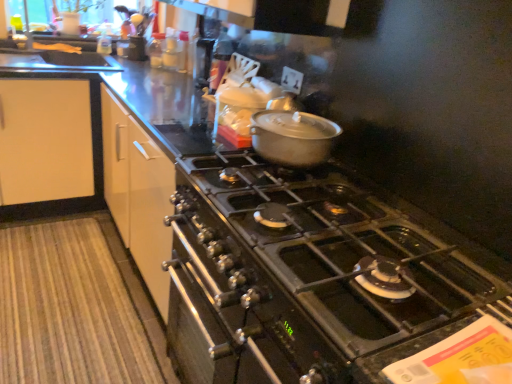
The height and width of the screenshot is (384, 512). What are the coordinates of `matte silver pot at center` in the screenshot? It's located at (293, 137).

This screenshot has width=512, height=384. What do you see at coordinates (57, 47) in the screenshot?
I see `yellow matte bread at upper left` at bounding box center [57, 47].

Identify the location of black matte gas stove at center. (352, 252).

Can you tell me how much yellow matte bread at upper left and matte silver pot at center differ in facing direction?

The angle between the facing direction of yellow matte bread at upper left and the facing direction of matte silver pot at center is 92.1 degrees.

Considering the relative positions of yellow matte bread at upper left and matte silver pot at center in the image provided, is yellow matte bread at upper left to the right of matte silver pot at center from the viewer's perspective?

Incorrect, yellow matte bread at upper left is not on the right side of matte silver pot at center.

From the image's perspective, is yellow matte bread at upper left located beneath matte silver pot at center?

No.

Is yellow matte bread at upper left inside the boundaries of matte silver pot at center, or outside?

yellow matte bread at upper left is outside matte silver pot at center.

Looking at the image, does black stainless steel oven at center seem bigger or smaller compared to yellow matte bread at upper left?

Considering their sizes, black stainless steel oven at center takes up more space than yellow matte bread at upper left.

Which is in front, point (211, 296) or point (69, 46)?

The point (211, 296) is more forward.

Can you tell me how much black stainless steel oven at center and yellow matte bread at upper left differ in facing direction?

The angular difference between black stainless steel oven at center and yellow matte bread at upper left is 89.2 degrees.

Between black stainless steel oven at center and yellow matte bread at upper left, which one appears on the right side from the viewer's perspective?

Positioned to the right is black stainless steel oven at center.

Can we say matte silver pot at center lies outside black matte gas stove at center?

Indeed, matte silver pot at center is completely outside black matte gas stove at center.

Can you confirm if matte silver pot at center is shorter than black matte gas stove at center?

Indeed, matte silver pot at center has a lesser height compared to black matte gas stove at center.

Identify the location of gas stove in front of the matte silver pot at center. The height and width of the screenshot is (384, 512). (352, 252).

Considering the relative sizes of matte silver pot at center and black matte gas stove at center in the image provided, is matte silver pot at center smaller than black matte gas stove at center?

Yes.

From a real-world perspective, is black matte gas stove at center beneath yellow matte bread at upper left?

Yes.

Considering the sizes of objects black matte gas stove at center and yellow matte bread at upper left in the image provided, who is thinner, black matte gas stove at center or yellow matte bread at upper left?

Thinner between the two is yellow matte bread at upper left.

From the image's perspective, is black matte gas stove at center located above or below yellow matte bread at upper left?

black matte gas stove at center is situated lower than yellow matte bread at upper left in the image.

Is black matte gas stove at center positioned far away from yellow matte bread at upper left?

That's right, there is a large distance between black matte gas stove at center and yellow matte bread at upper left.

Is yellow matte bread at upper left positioned far away from black matte gas stove at center?

Absolutely, yellow matte bread at upper left is distant from black matte gas stove at center.

Which of these two, yellow matte bread at upper left or black matte gas stove at center, stands taller?

black matte gas stove at center.

Considering the positions of point (57, 49) and point (355, 301), is point (57, 49) closer or farther from the camera than point (355, 301)?

Point (57, 49) appears to be farther away from the viewer than point (355, 301).

Considering the sizes of objects yellow matte bread at upper left and black matte gas stove at center in the image provided, who is bigger, yellow matte bread at upper left or black matte gas stove at center?

With larger size is black matte gas stove at center.

Looking at this image, from a real-world perspective, is black matte gas stove at center positioned above or below matte silver pot at center?

In terms of real-world spatial position, black matte gas stove at center is below matte silver pot at center.

Considering the sizes of objects black matte gas stove at center and matte silver pot at center in the image provided, who is shorter, black matte gas stove at center or matte silver pot at center?

Standing shorter between the two is matte silver pot at center.

From the image's perspective, does black matte gas stove at center appear higher than matte silver pot at center?

Incorrect, from the image's perspective, black matte gas stove at center is lower than matte silver pot at center.

Locate an element on the screen. The image size is (512, 384). food behind the black stainless steel oven at center is located at coordinates point(57,47).

Is yellow matte bread at upper left closer to the viewer compared to black stainless steel oven at center?

No, it is not.

Is yellow matte bread at upper left placed right next to black stainless steel oven at center?

yellow matte bread at upper left and black stainless steel oven at center are not in contact.

The height and width of the screenshot is (384, 512). Identify the location of food above the matte silver pot at center (from the image's perspective). (57, 47).

Identify the location of food located on the left of black stainless steel oven at center. (57, 47).

Estimate the real-world distances between objects in this image. Which object is further from black matte gas stove at center, matte silver pot at center or yellow matte bread at upper left?

Among the two, yellow matte bread at upper left is located further to black matte gas stove at center.

Based on the photo, considering their positions, is black matte gas stove at center positioned further to black stainless steel oven at center than matte silver pot at center?

Based on the image, matte silver pot at center appears to be further to black stainless steel oven at center.

When comparing their distances from black matte gas stove at center, does black stainless steel oven at center or yellow matte bread at upper left seem closer?

black stainless steel oven at center.

Considering their positions, is matte silver pot at center positioned further to black stainless steel oven at center than black matte gas stove at center?

matte silver pot at center lies further to black stainless steel oven at center than the other object.

From the image, which object appears to be farther from black matte gas stove at center, matte silver pot at center or black stainless steel oven at center?

Based on the image, matte silver pot at center appears to be further to black matte gas stove at center.

Consider the image. Looking at the image, which one is located further to matte silver pot at center, black stainless steel oven at center or black matte gas stove at center?

The object further to matte silver pot at center is black stainless steel oven at center.

From the image, which object appears to be nearer to matte silver pot at center, yellow matte bread at upper left or black stainless steel oven at center?

black stainless steel oven at center is closer to matte silver pot at center.

Considering their positions, is black matte gas stove at center positioned further to matte silver pot at center than black stainless steel oven at center?

black stainless steel oven at center lies further to matte silver pot at center than the other object.

Locate an element on the screen. kitchen appliance positioned between black stainless steel oven at center and yellow matte bread at upper left from near to far is located at coordinates (293, 137).

Locate an element on the screen. This screenshot has height=384, width=512. gas stove that lies between matte silver pot at center and black stainless steel oven at center from top to bottom is located at coordinates (352, 252).

You are a GUI agent. You are given a task and a screenshot of the screen. Output one action in this format:
    pyautogui.click(x=<x>, y=<y>)
    Task: Click on the oven between black matte gas stove at center and yellow matte bread at upper left in the front-back direction
    The width and height of the screenshot is (512, 384).
    Given the screenshot: What is the action you would take?
    pyautogui.click(x=234, y=310)

Where is `kitchen appliance positioned between black matte gas stove at center and yellow matte bread at upper left from near to far`? This screenshot has height=384, width=512. kitchen appliance positioned between black matte gas stove at center and yellow matte bread at upper left from near to far is located at coordinates (293, 137).